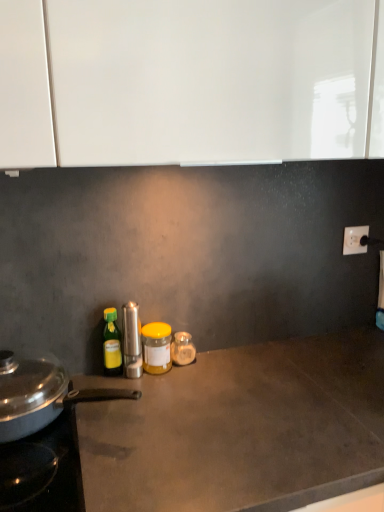
Identify the location of vacant region to the right of yellow matte jar at center, which is the 2th bottle from right to left. The height and width of the screenshot is (512, 384). (217, 371).